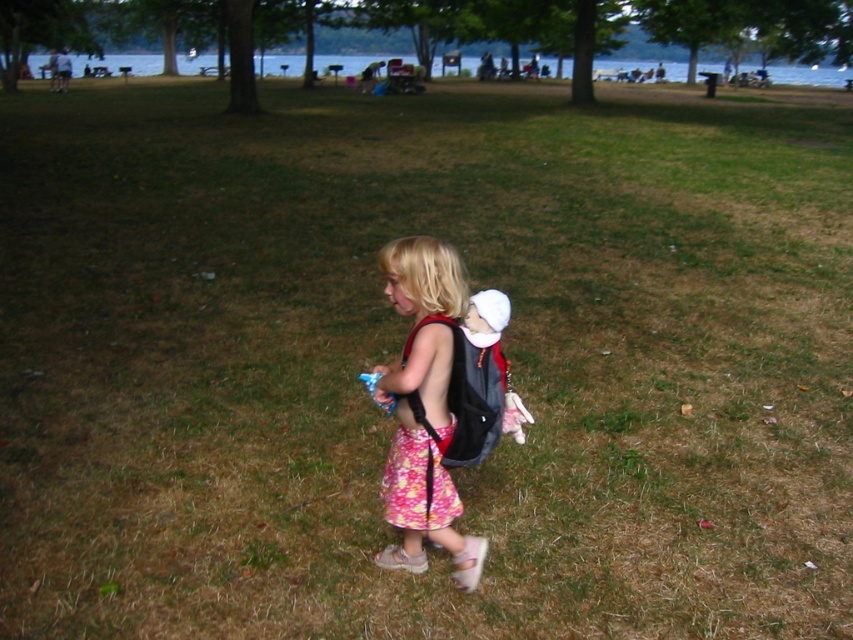
Question: Is floral cotton skirt at center positioned at the back of floral fabric dress at center?

Choices:
 (A) no
 (B) yes

Answer: (A)

Question: From the image, what is the correct spatial relationship of floral cotton skirt at center in relation to floral fabric dress at center?

Choices:
 (A) left
 (B) right

Answer: (B)

Question: Which of the following is the farthest from the observer?

Choices:
 (A) floral cotton skirt at center
 (B) floral fabric dress at center

Answer: (B)

Question: Is floral cotton skirt at center positioned in front of floral fabric dress at center?

Choices:
 (A) no
 (B) yes

Answer: (B)

Question: Which point is farther to the camera?

Choices:
 (A) floral cotton skirt at center
 (B) floral fabric dress at center

Answer: (B)

Question: Which object is closer to the camera taking this photo?

Choices:
 (A) floral fabric dress at center
 (B) floral cotton skirt at center

Answer: (B)